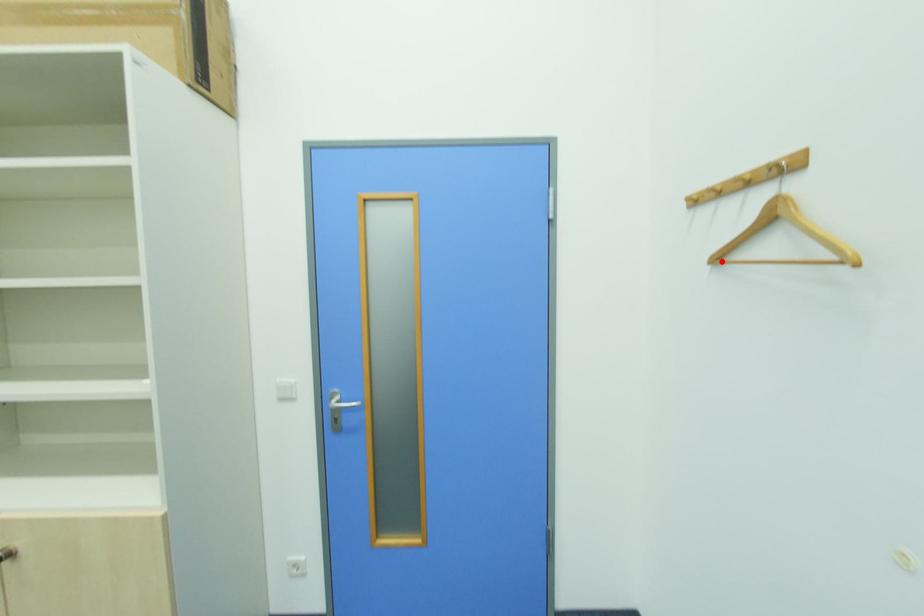
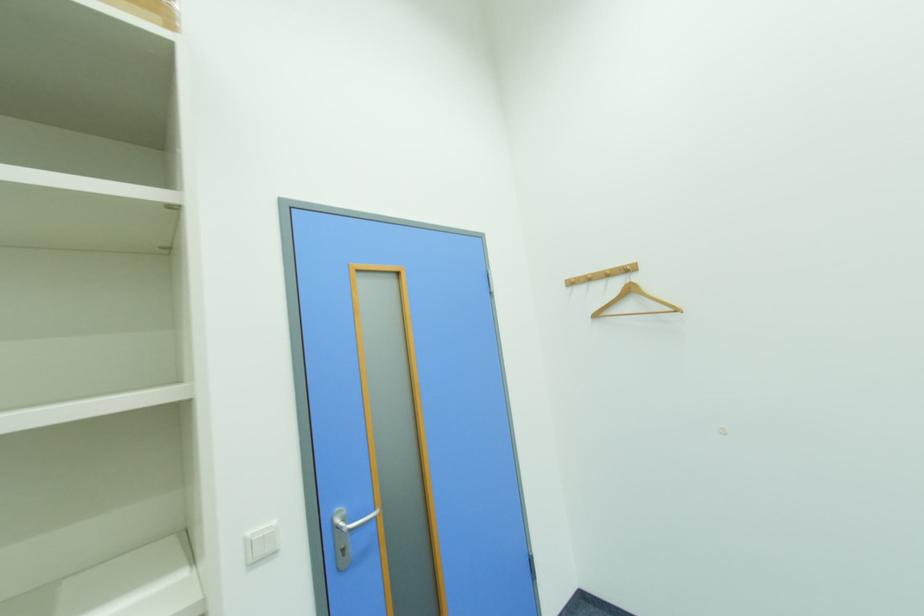
Where in the second image is the point corresponding to the highlighted location from the first image?

(601, 317)